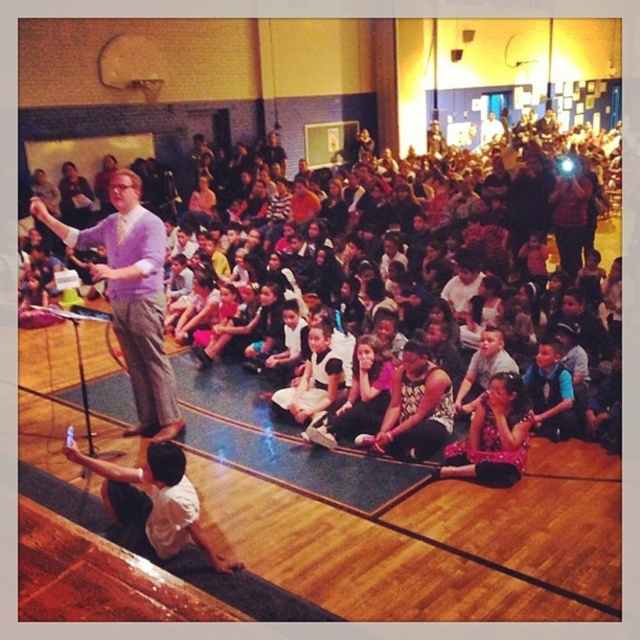
Between point (157, 291) and point (323, 392), which one is positioned behind?

Point (323, 392)

Who is shorter, purple shirt at center or white cotton dress at center?

With less height is white cotton dress at center.

Between point (129, 275) and point (285, 404), which one is positioned in front?

Positioned in front is point (129, 275).

The width and height of the screenshot is (640, 640). Find the location of `purple shirt at center`. purple shirt at center is located at coordinates (131, 296).

In the scene shown: Which is below, printed cotton dress at lower center or patterned fabric dress at center?

printed cotton dress at lower center

Between point (493, 390) and point (444, 392), which one is positioned in front?

Point (493, 390) is in front.

Is point (516, 420) farther from viewer compared to point (442, 381)?

No, (516, 420) is in front of (442, 381).

Image resolution: width=640 pixels, height=640 pixels. I want to click on printed cotton dress at lower center, so click(492, 436).

Does purple shirt at center appear under patterned fabric dress at center?

Incorrect, purple shirt at center is not positioned below patterned fabric dress at center.

Who is positioned more to the left, purple shirt at center or patterned fabric dress at center?

Positioned to the left is purple shirt at center.

At what (x,y) coordinates should I click in order to perform the action: click on purple shirt at center. Please return your answer as a coordinate pair (x, y). Looking at the image, I should click on (131, 296).